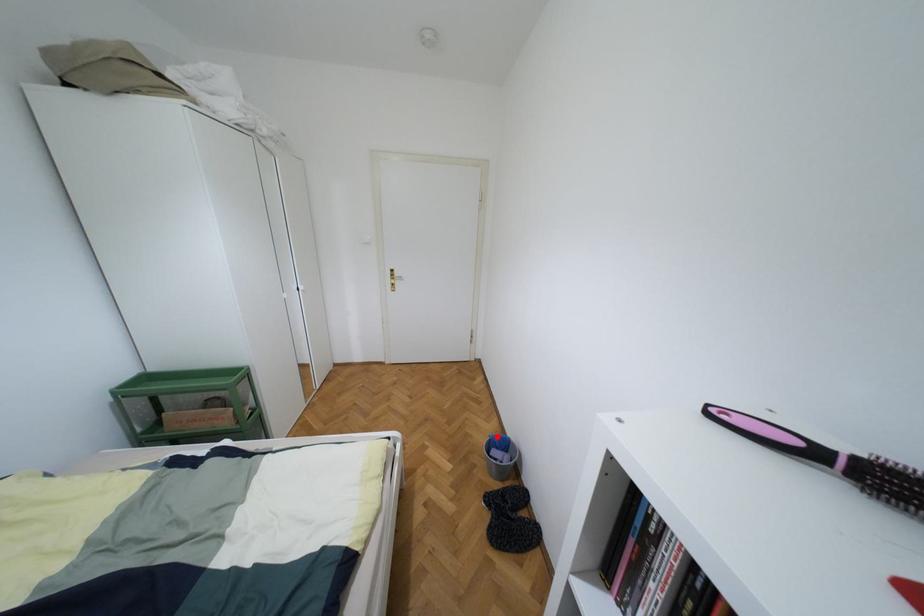
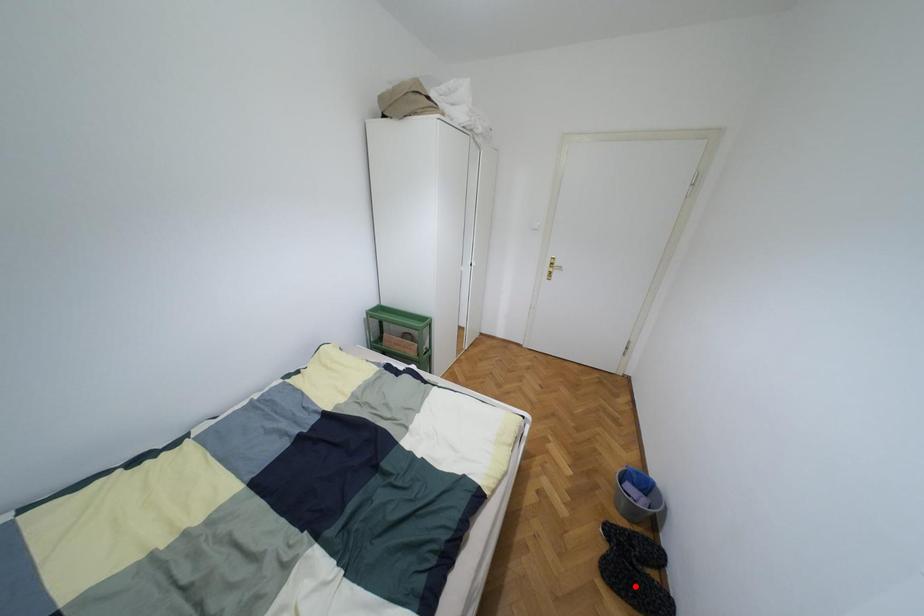
I am providing you with two images of the same scene from different viewpoints. A red point is marked on the first image and another point is marked on the second image. Is the red point in image1 aligned with the point shown in image2?

No